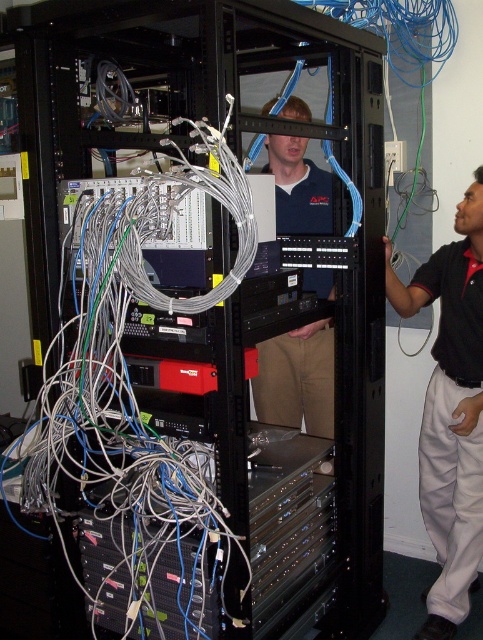
You are a technician trying to install a new component in the server rack. You have a black cotton shirt at center and a blue cotton shirt at center. Which shirt should you avoid wearing to prevent getting caught in the tangled cables?

The black cotton shirt at center might be wider than the blue cotton shirt at center, so it has a higher risk of getting caught in the tangled cables. Avoid wearing the black cotton shirt at center.

You are an IT technician standing in front of the server rack. You need to access the network switches on the top shelf. Is the black cotton shirt at center in your way?

The black cotton shirt at center is located at point [451,412], which is likely at the lower part of the server rack. Since the network switches are on the top shelf, the shirt is not in your way.

You are an IT technician working in a data center. You need to access the black cotton shirt at center and the blue cotton shirt at center. Which shirt is located to the right of the other?

The black cotton shirt at center is positioned on the right side of blue cotton shirt at center.